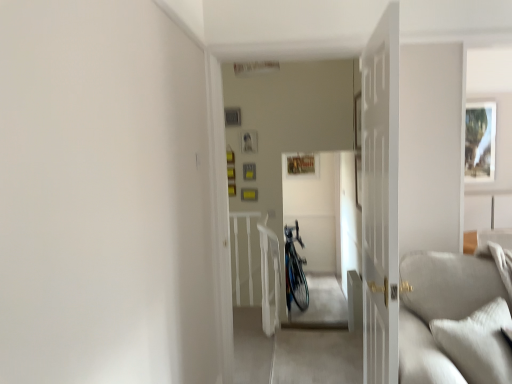
Question: From the image's perspective, is shiny metallic bicycle at center located above matte white picture frame at upper right?

Choices:
 (A) no
 (B) yes

Answer: (A)

Question: Is shiny metallic bicycle at center facing towards matte white picture frame at upper right?

Choices:
 (A) yes
 (B) no

Answer: (B)

Question: Is shiny metallic bicycle at center at the left side of matte white picture frame at upper right?

Choices:
 (A) no
 (B) yes

Answer: (B)

Question: From a real-world perspective, is shiny metallic bicycle at center on top of matte white picture frame at upper right?

Choices:
 (A) yes
 (B) no

Answer: (B)

Question: Is shiny metallic bicycle at center positioned with its back to matte white picture frame at upper right?

Choices:
 (A) no
 (B) yes

Answer: (A)

Question: Is white wooden door at center spatially inside matte white picture frame at upper right, or outside of it?

Choices:
 (A) outside
 (B) inside

Answer: (A)

Question: Looking at the image, does white wooden door at center seem bigger or smaller compared to matte white picture frame at upper right?

Choices:
 (A) small
 (B) big

Answer: (B)

Question: Is white wooden door at center taller or shorter than matte white picture frame at upper right?

Choices:
 (A) tall
 (B) short

Answer: (A)

Question: In the image, is white wooden door at center positioned in front of or behind matte white picture frame at upper right?

Choices:
 (A) behind
 (B) front

Answer: (B)

Question: From a real-world perspective, is light gray corduroy couch at lower right above or below white wooden door at center?

Choices:
 (A) below
 (B) above

Answer: (A)

Question: In terms of height, does light gray corduroy couch at lower right look taller or shorter compared to white wooden door at center?

Choices:
 (A) tall
 (B) short

Answer: (B)

Question: Does point (505, 352) appear closer or farther from the camera than point (389, 122)?

Choices:
 (A) closer
 (B) farther

Answer: (B)

Question: Is light gray corduroy couch at lower right wider or thinner than white wooden door at center?

Choices:
 (A) thin
 (B) wide

Answer: (B)

Question: Looking at their shapes, would you say shiny metallic bicycle at center is wider or thinner than matte white picture frame at upper right?

Choices:
 (A) thin
 (B) wide

Answer: (B)

Question: From a real-world perspective, is shiny metallic bicycle at center positioned above or below matte white picture frame at upper right?

Choices:
 (A) below
 (B) above

Answer: (A)